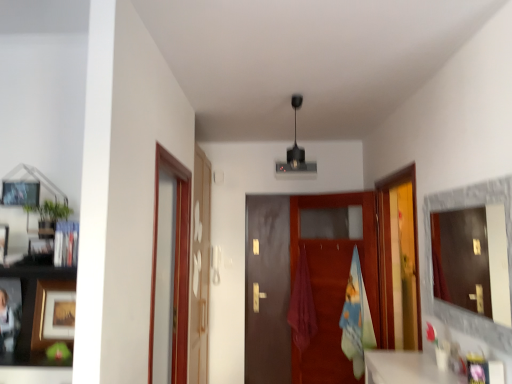
What do you see at coordinates (310, 280) in the screenshot? The height and width of the screenshot is (384, 512). I see `brown matte door at center` at bounding box center [310, 280].

Describe the element at coordinates (53, 313) in the screenshot. I see `wooden matte picture frame at left, the 1th picture frame in the bottom-to-top sequence` at that location.

This screenshot has width=512, height=384. What do you see at coordinates (20, 193) in the screenshot? I see `matte black picture frame at upper left, acting as the first picture frame starting from the top` at bounding box center [20, 193].

Describe the element at coordinates (475, 259) in the screenshot. I see `matte gray mirror at right` at that location.

The image size is (512, 384). Identify the location of brown matte door at center. (310, 280).

Does transparent glass door at left, placed as the 2th glass door when sorted from right to left, turn towards matte black picture frame at upper left, acting as the 2th picture frame starting from the back?

No, transparent glass door at left, placed as the 2th glass door when sorted from right to left, does not turn towards matte black picture frame at upper left, acting as the 2th picture frame starting from the back.

Is point (202, 248) positioned before point (23, 190)?

No, it is behind (23, 190).

Does transparent glass door at left, placed as the 2th glass door when sorted from right to left, touch matte black picture frame at upper left, which is the second picture frame in front-to-back order?

No, transparent glass door at left, placed as the 2th glass door when sorted from right to left, is not with matte black picture frame at upper left, which is the second picture frame in front-to-back order.

Choose the correct answer: Is wooden picture frame at left, which is counted as the third picture frame, starting from the back, inside matte black picture frame at upper left, acting as the first picture frame starting from the top, or outside it?

wooden picture frame at left, which is counted as the third picture frame, starting from the back, is not enclosed by matte black picture frame at upper left, acting as the first picture frame starting from the top.

Is wooden picture frame at left, which is counted as the third picture frame, starting from the back, facing towards matte black picture frame at upper left, acting as the 2th picture frame starting from the back?

No, wooden picture frame at left, which is counted as the third picture frame, starting from the back, is not turned towards matte black picture frame at upper left, acting as the 2th picture frame starting from the back.

Which of these two, wooden picture frame at left, marked as the 2th picture frame in a bottom-to-top arrangement, or matte black picture frame at upper left, which appears as the 3th picture frame when ordered from the bottom, stands taller?

With more height is wooden picture frame at left, marked as the 2th picture frame in a bottom-to-top arrangement.

Is wooden picture frame at left, the 1th picture frame positioned from the front, not close to matte black picture frame at upper left, which appears as the 3th picture frame when ordered from the bottom?

Actually, wooden picture frame at left, the 1th picture frame positioned from the front, and matte black picture frame at upper left, which appears as the 3th picture frame when ordered from the bottom, are a little close together.

Find the location of `glass door located on the right of brown matte door at center`. glass door located on the right of brown matte door at center is located at coordinates (399, 259).

Does brown matte door at center turn towards transparent glass door at right, which appears as the first glass door when viewed from the right?

Yes.

Which is less distant, (x=308, y=205) or (x=414, y=219)?

The point (x=414, y=219) is more forward.

Which object is further away from the camera taking this photo, brown matte door at center or transparent glass door at right, which appears as the first glass door when viewed from the right?

brown matte door at center.

Considering the sizes of objects transparent glass door at left, placed as the 2th glass door when sorted from right to left, and wooden picture frame at left, marked as the 2th picture frame in a bottom-to-top arrangement, in the image provided, who is wider, transparent glass door at left, placed as the 2th glass door when sorted from right to left, or wooden picture frame at left, marked as the 2th picture frame in a bottom-to-top arrangement,?

transparent glass door at left, placed as the 2th glass door when sorted from right to left.

From the picture: Could you tell me if transparent glass door at left, the 2th glass door when ordered from left to right, is turned towards wooden picture frame at left, which is counted as the third picture frame, starting from the back?

No.

In the scene shown: From a real-world perspective, is transparent glass door at left, the 2th glass door when ordered from left to right, on wooden picture frame at left, the 1th picture frame positioned from the front?

No.

Which of these two, transparent glass door at right, which is the 3th glass door from left to right, or wooden matte picture frame at left, the 1th picture frame from the back, is smaller?

wooden matte picture frame at left, the 1th picture frame from the back.

Considering their positions, is transparent glass door at right, which is the 3th glass door from left to right, located in front of or behind wooden matte picture frame at left, the 1th picture frame from the back?

transparent glass door at right, which is the 3th glass door from left to right, is positioned farther from the viewer than wooden matte picture frame at left, the 1th picture frame from the back.

Is matte pink towel at center thinner than transparent glass door at left, the 3th glass door from the right?

Incorrect, the width of matte pink towel at center is not less than that of transparent glass door at left, the 3th glass door from the right.

Considering the sizes of matte pink towel at center and transparent glass door at left, the 1th glass door in the left-to-right sequence, in the image, is matte pink towel at center taller or shorter than transparent glass door at left, the 1th glass door in the left-to-right sequence,?

In the image, matte pink towel at center appears to be shorter than transparent glass door at left, the 1th glass door in the left-to-right sequence.

Based on the photo, is matte pink towel at center completely or partially outside of transparent glass door at left, the 3th glass door from the right?

Yes.

From the image's perspective, is matte pink towel at center positioned above or below transparent glass door at left, the 1th glass door in the left-to-right sequence?

Based on their image positions, matte pink towel at center is located beneath transparent glass door at left, the 1th glass door in the left-to-right sequence.

Considering the sizes of matte black picture frame at upper left, acting as the 2th picture frame starting from the back, and matte gray mirror at right in the image, is matte black picture frame at upper left, acting as the 2th picture frame starting from the back, taller or shorter than matte gray mirror at right?

In the image, matte black picture frame at upper left, acting as the 2th picture frame starting from the back, appears to be shorter than matte gray mirror at right.

Which object is thinner, matte black picture frame at upper left, which appears as the 3th picture frame when ordered from the bottom, or matte gray mirror at right?

matte black picture frame at upper left, which appears as the 3th picture frame when ordered from the bottom, is thinner.

From the image's perspective, would you say matte black picture frame at upper left, which is the second picture frame in front-to-back order, is shown under matte gray mirror at right?

Incorrect, from the image's perspective, matte black picture frame at upper left, which is the second picture frame in front-to-back order, is higher than matte gray mirror at right.

Measure the distance from matte black picture frame at upper left, which is the second picture frame in front-to-back order, to matte gray mirror at right.

A distance of 3.70 meters exists between matte black picture frame at upper left, which is the second picture frame in front-to-back order, and matte gray mirror at right.

There is a transparent glass door at left, placed as the 2th glass door when sorted from right to left. Identify the location of the 3rd picture frame above it (from the image's perspective). (20, 193).

The image size is (512, 384). I want to click on the 1st picture frame to the right when counting from the wooden picture frame at left, which ranks as the second picture frame in top-to-bottom order, so click(x=20, y=193).

Which object lies further to the anchor point matte black picture frame at upper left, acting as the 2th picture frame starting from the back, matte pink towel at center or matte gray mirror at right?

matte gray mirror at right.

When comparing their distances from matte pink towel at center, does transparent glass door at right, which is the 3th glass door from left to right, or wooden picture frame at left, the 1th picture frame positioned from the front, seem closer?

Based on the image, transparent glass door at right, which is the 3th glass door from left to right, appears to be nearer to matte pink towel at center.

From the image, which object appears to be farther from transparent glass door at left, the 2th glass door when ordered from left to right, wooden picture frame at left, which is counted as the third picture frame, starting from the back, or wooden matte picture frame at left, which is counted as the 3th picture frame, starting from the front?

wooden picture frame at left, which is counted as the third picture frame, starting from the back.

Based on their spatial positions, is matte black picture frame at upper left, which is the second picture frame in front-to-back order, or transparent glass door at left, the 3th glass door from the right, further from wooden picture frame at left, the 1th picture frame positioned from the front?

transparent glass door at left, the 3th glass door from the right, is positioned further to the anchor wooden picture frame at left, the 1th picture frame positioned from the front.

Considering their positions, is brown matte door at center positioned further to blue cotton bath towel at center than wooden picture frame at left, which is counted as the third picture frame, starting from the back?

wooden picture frame at left, which is counted as the third picture frame, starting from the back, is positioned further to the anchor blue cotton bath towel at center.

Considering their positions, is blue cotton bath towel at center positioned further to matte pink towel at center than matte black picture frame at upper left, which is the second picture frame in front-to-back order?

matte black picture frame at upper left, which is the second picture frame in front-to-back order, lies further to matte pink towel at center than the other object.

Which object lies nearer to the anchor point wooden matte picture frame at left, the 1th picture frame in the bottom-to-top sequence, matte black picture frame at upper left, acting as the 2th picture frame starting from the back, or transparent glass door at left, placed as the 2th glass door when sorted from right to left?

matte black picture frame at upper left, acting as the 2th picture frame starting from the back, is closer to wooden matte picture frame at left, the 1th picture frame in the bottom-to-top sequence.

Considering their positions, is matte pink towel at center positioned closer to blue cotton bath towel at center than brown matte door at center?

brown matte door at center is positioned closer to the anchor blue cotton bath towel at center.

You are a GUI agent. You are given a task and a screenshot of the screen. Output one action in this format:
    pyautogui.click(x=<x>, y=<y>)
    Task: Click on the bath towel situated between matte black picture frame at upper left, acting as the 2th picture frame starting from the back, and matte gray mirror at right from left to right
    
    Given the screenshot: What is the action you would take?
    pyautogui.click(x=356, y=319)

Identify the location of bath towel between wooden picture frame at left, which ranks as the second picture frame in top-to-bottom order, and brown matte door at center, along the z-axis. (356, 319).

At what (x,y) coordinates should I click in order to perform the action: click on mirror situated between wooden picture frame at left, which is counted as the third picture frame, starting from the back, and transparent glass door at right, which is the 3th glass door from left to right, from left to right. Please return your answer as a coordinate pair (x, y). The height and width of the screenshot is (384, 512). Looking at the image, I should click on (475, 259).

Find the location of `bath towel located between wooden picture frame at left, which is counted as the third picture frame, starting from the back, and matte pink towel at center in the depth direction`. bath towel located between wooden picture frame at left, which is counted as the third picture frame, starting from the back, and matte pink towel at center in the depth direction is located at coordinates (356, 319).